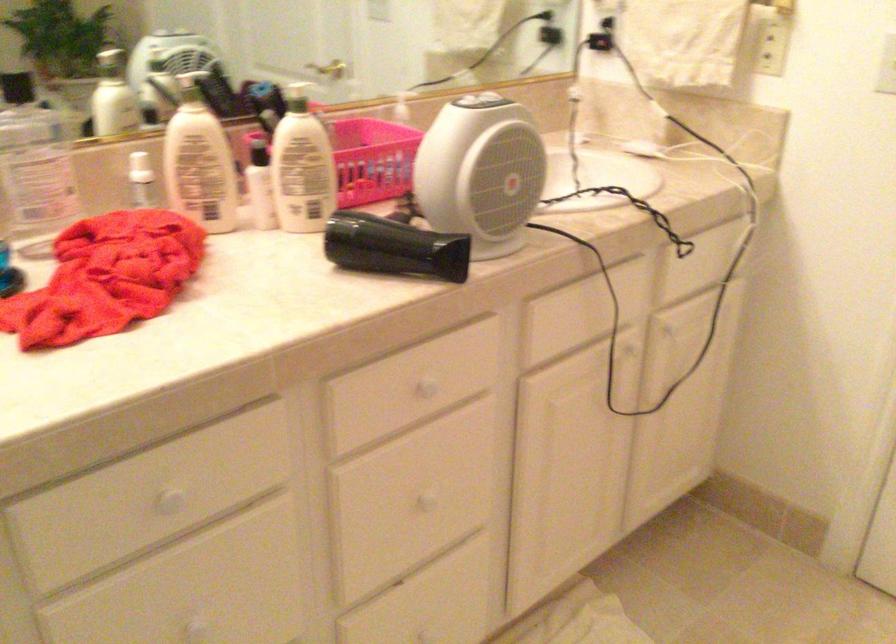
You are a GUI agent. You are given a task and a screenshot of the screen. Output one action in this format:
    pyautogui.click(x=<x>, y=<y>)
    Task: Click on the pink plastic basket
    
    Given the screenshot: What is the action you would take?
    pyautogui.click(x=367, y=158)